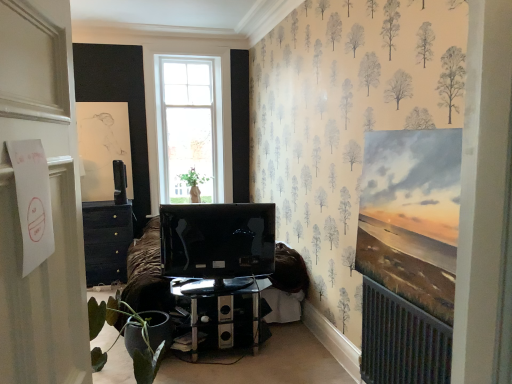
Question: From the image's perspective, is green matte plant at lower left positioned above or below satin black television at upper left, arranged as the 2th television when viewed from the right?

Choices:
 (A) above
 (B) below

Answer: (B)

Question: In terms of width, does green matte plant at lower left look wider or thinner when compared to satin black television at upper left, which appears as the second television when ordered from the bottom?

Choices:
 (A) thin
 (B) wide

Answer: (B)

Question: Which object is positioned farthest from the transparent glass desk at center?

Choices:
 (A) green matte vase at center
 (B) white matte door at left
 (C) green matte plant at lower left
 (D) matte black tv at center, the 1th television positioned from the right
 (E) satin black television at upper left, marked as the 2th television in a front-to-back arrangement

Answer: (A)

Question: Estimate the real-world distances between objects in this image. Which object is closer to the green matte plant at lower left?

Choices:
 (A) satin black television at upper left, marked as the 2th television in a front-to-back arrangement
 (B) transparent glass desk at center
 (C) green matte vase at center
 (D) white matte door at left
 (E) matte black tv at center, the 2th television from the back

Answer: (B)